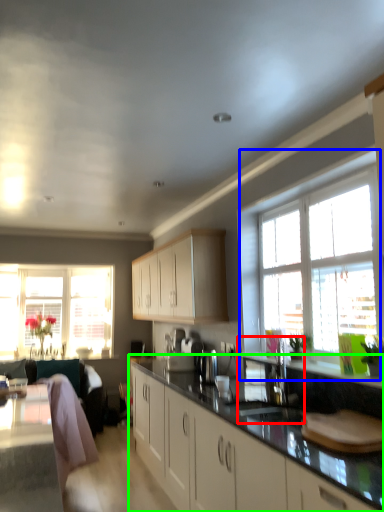
Question: Which object is the farthest from sink (highlighted by a red box)? Choose among these: window (highlighted by a blue box) or countertop (highlighted by a green box).

Choices:
 (A) window
 (B) countertop

Answer: (A)